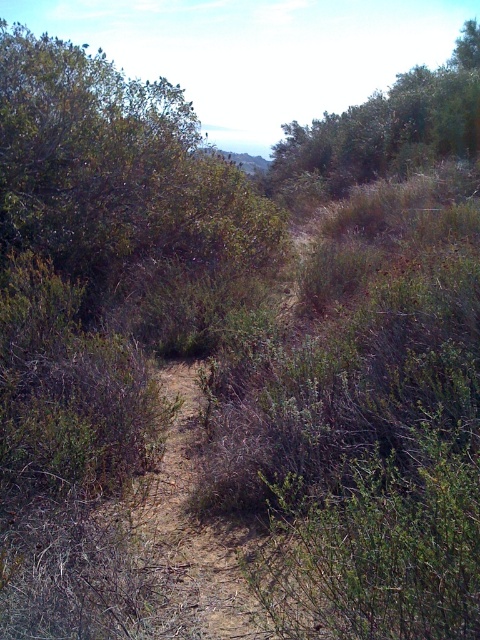
Question: Can you confirm if green leafy bush at center is positioned to the left of green leafy tree at upper right?

Choices:
 (A) no
 (B) yes

Answer: (B)

Question: Which point is farther from the camera taking this photo?

Choices:
 (A) (257, 243)
 (B) (402, 173)

Answer: (B)

Question: Considering the relative positions of green leafy bush at center and green leafy tree at upper right in the image provided, where is green leafy bush at center located with respect to green leafy tree at upper right?

Choices:
 (A) right
 (B) left

Answer: (B)

Question: Can you confirm if green leafy bush at center is thinner than green leafy tree at upper right?

Choices:
 (A) no
 (B) yes

Answer: (B)